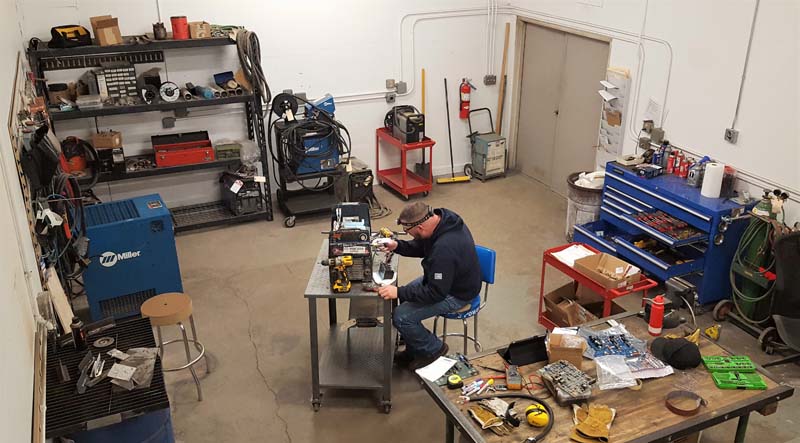
Locate an element on the screen. The width and height of the screenshot is (800, 443). switch is located at coordinates (728, 139).